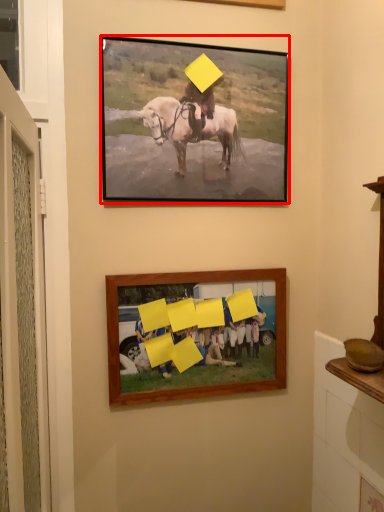
Question: Considering the relative positions of picture frame (annotated by the red box) and picture frame in the image provided, where is picture frame (annotated by the red box) located with respect to the staircase?

Choices:
 (A) right
 (B) left

Answer: (B)